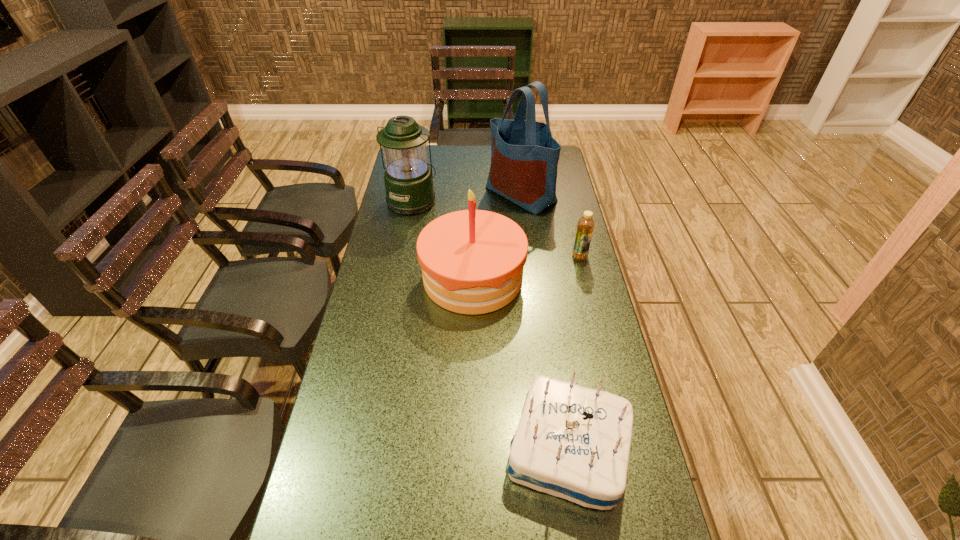
Where is `vacant space located on the front of the bottle`? The image size is (960, 540). vacant space located on the front of the bottle is located at coordinates (598, 330).

Where is `object that is at the left edge`? This screenshot has height=540, width=960. object that is at the left edge is located at coordinates (408, 179).

Where is `handbag that is at the right edge`? handbag that is at the right edge is located at coordinates (524, 156).

The width and height of the screenshot is (960, 540). What are the coordinates of `birthday cake located at the right edge` in the screenshot? It's located at (572, 442).

Locate an element on the screen. Image resolution: width=960 pixels, height=540 pixels. bottle at the right edge is located at coordinates (585, 226).

Find the location of `blank space at the left edge of the desktop`. blank space at the left edge of the desktop is located at coordinates (356, 389).

Identify the location of vacant space at the right edge of the desktop. Image resolution: width=960 pixels, height=540 pixels. (561, 178).

This screenshot has width=960, height=540. I want to click on free space between the handbag and the lantern, so click(x=467, y=197).

The width and height of the screenshot is (960, 540). I want to click on free area in between the lantern and the shorter birthday cake, so click(x=491, y=325).

What are the coordinates of `vacant space that is in between the shortest object and the shorter birthday cake` in the screenshot? It's located at click(574, 353).